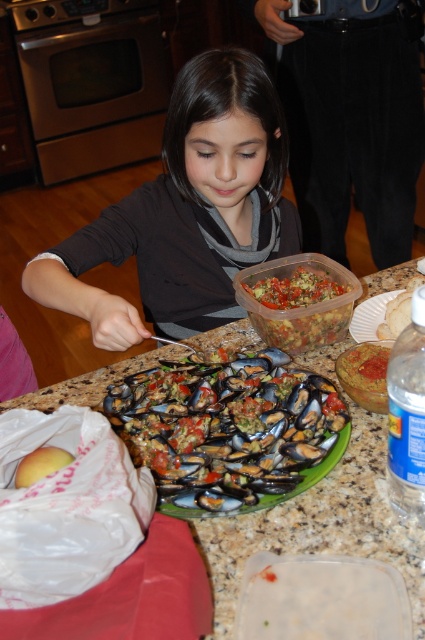
Does shiny black mussels at center appear on the left side of white crumbly pastry at center?

Indeed, shiny black mussels at center is positioned on the left side of white crumbly pastry at center.

Which is above, shiny black mussels at center or white crumbly pastry at center?

white crumbly pastry at center is higher up.

Image resolution: width=425 pixels, height=640 pixels. What do you see at coordinates (229, 429) in the screenshot?
I see `shiny black mussels at center` at bounding box center [229, 429].

At what (x,y) coordinates should I click in order to perform the action: click on shiny black mussels at center. Please return your answer as a coordinate pair (x, y). The width and height of the screenshot is (425, 640). Looking at the image, I should click on (229, 429).

Does shiny black mussels at center appear over yellow smooth mango at lower left?

Yes, shiny black mussels at center is above yellow smooth mango at lower left.

Is shiny black mussels at center positioned in front of yellow smooth mango at lower left?

No.

Is point (237, 492) farther from viewer compared to point (25, 483)?

Yes, point (237, 492) is farther from viewer.

Where is `shiny black mussels at center`? This screenshot has height=640, width=425. shiny black mussels at center is located at coordinates (229, 429).

Locate an element on the screen. The image size is (425, 640). matte black shirt at center is located at coordinates (187, 211).

Can you confirm if matte black shirt at center is wider than translucent plastic container at center?

Yes.

Find the location of a particular element. matte black shirt at center is located at coordinates (187, 211).